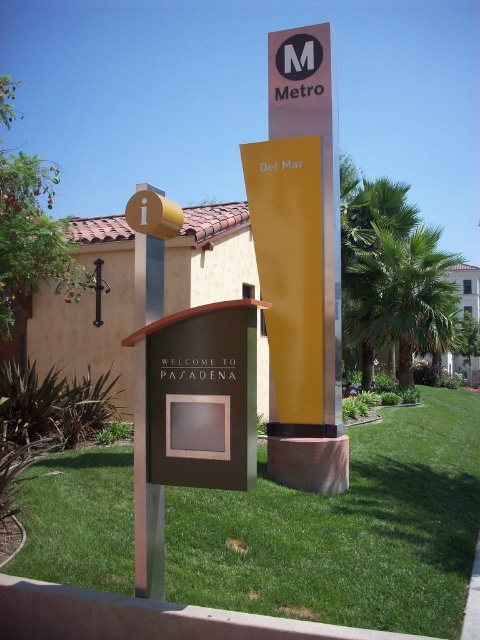
You are a gardener who needs to mow the green grass at lower center and trim the yellow matte sign at upper center. Which object requires a taller tool to work on?

The yellow matte sign at upper center requires a taller tool because it is taller than the green grass at lower center.